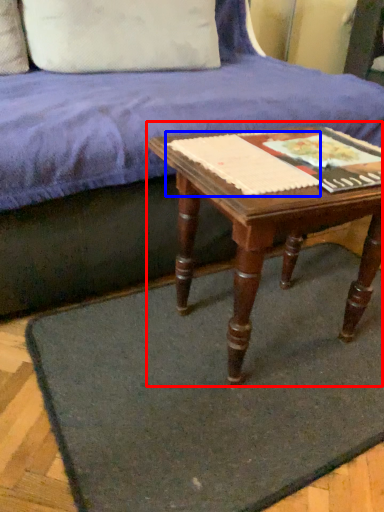
Question: Which of the following is the farthest to the observer, table (highlighted by a red box) or paperback book (highlighted by a blue box)?

Choices:
 (A) table
 (B) paperback book

Answer: (B)